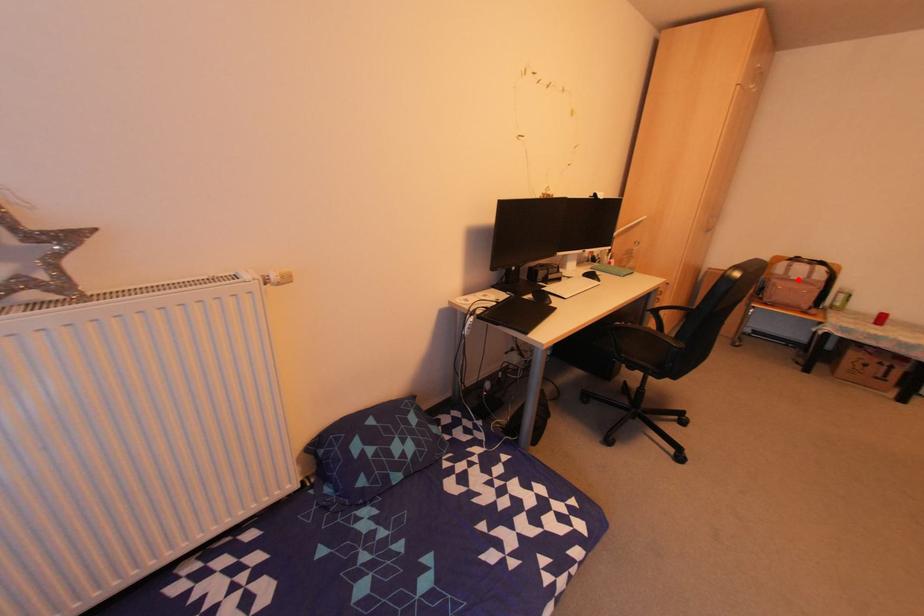
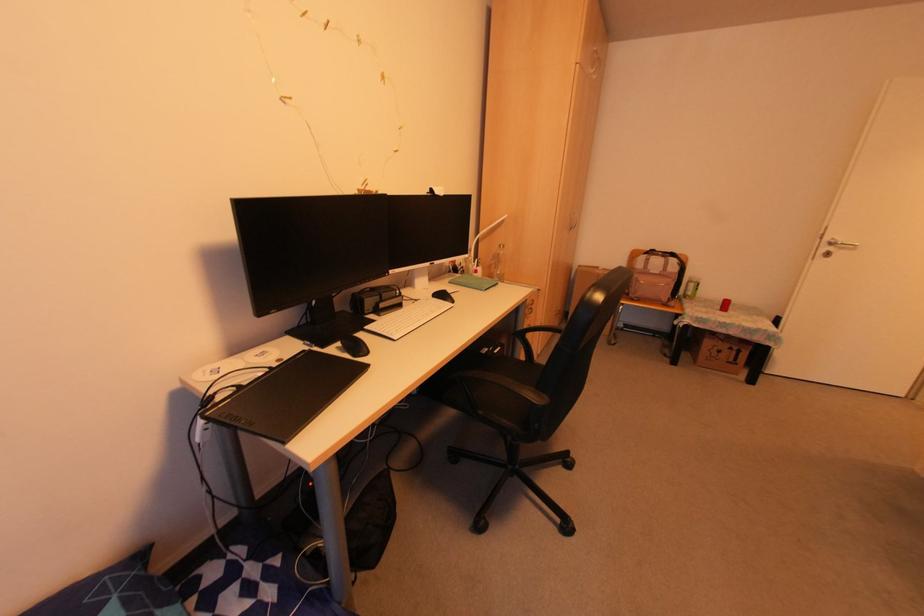
The point at the highlighted location is marked in the first image. Where is the corresponding point in the second image?

(655, 273)